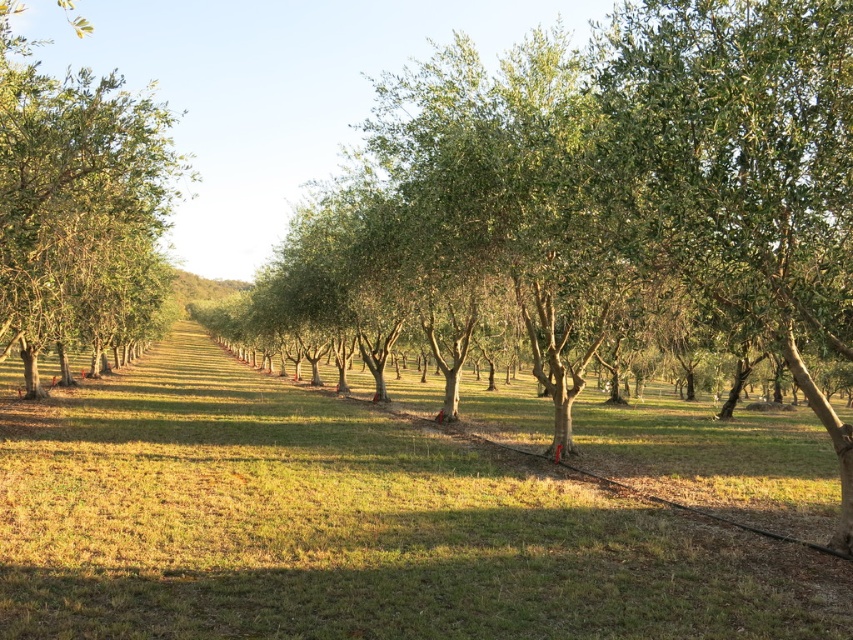
You are standing at the point marked by the coordinates [346,525] in the olive grove. What can you see directly beneath your feet?

At point [346,525] lies green grass at center, so you can see green grass at center directly beneath your feet.

You are a gardener who wants to plant a new flower bed between the green grass at center and the green leafy tree at center. Since the flower bed needs to be at least 1 meter tall, which object should you consider for the base of the flower bed?

The green leafy tree at center has a greater height than the green grass at center, so you should use the green leafy tree at center as the base for the flower bed since it meets the height requirement of at least 1 meter.

You are a farmer checking the spacing between the green grass at center and the green leafy tree at left. Which has a wider spread in terms of width?

The green grass at center has a larger width than the green leafy tree at left according to the description.